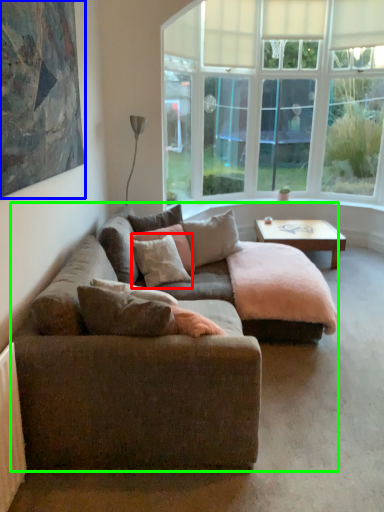
Question: Based on their relative distances, which object is farther from pillow (highlighted by a red box)? Choose from picture frame (highlighted by a blue box) and studio couch (highlighted by a green box).

Choices:
 (A) picture frame
 (B) studio couch

Answer: (A)